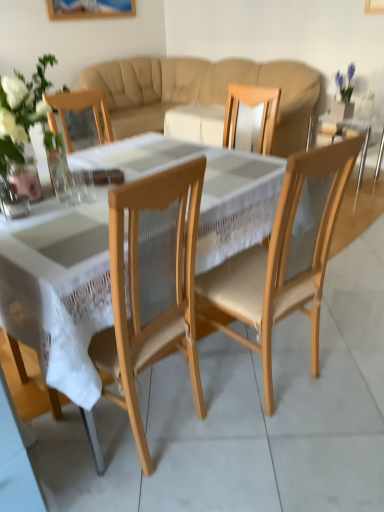
Where is `vacant region to the left of clear glass at center, which is the 1th tableware from left to right`? vacant region to the left of clear glass at center, which is the 1th tableware from left to right is located at coordinates (35, 206).